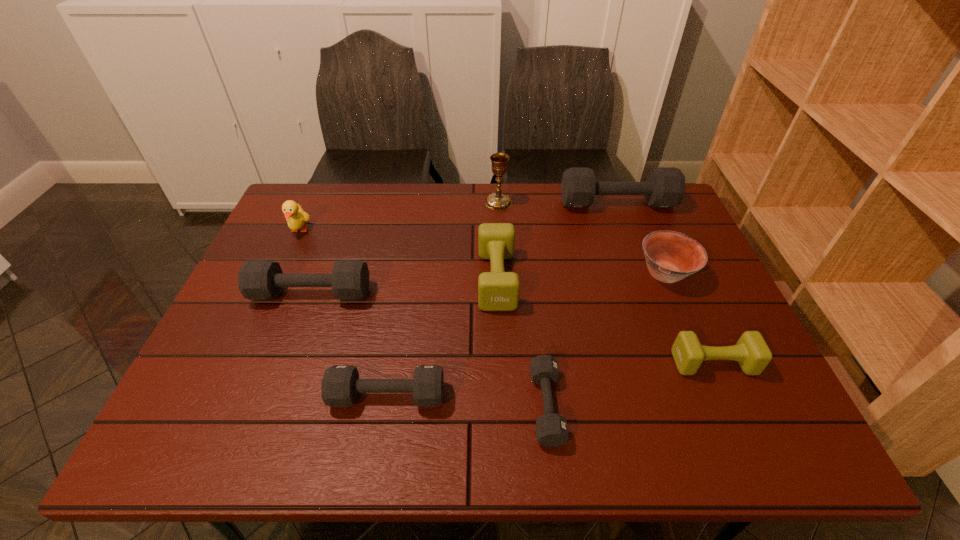
The image size is (960, 540). I want to click on vacant area that satisfies the following two spatial constraints: 1. on the back side of the third biggest gray dumbbell; 2. on the left side of the smaller olive dumbbell, so click(x=393, y=363).

Where is `free region that satisfies the following two spatial constraints: 1. on the front side of the chalice; 2. on the left side of the shortest dumbbell`? The image size is (960, 540). free region that satisfies the following two spatial constraints: 1. on the front side of the chalice; 2. on the left side of the shortest dumbbell is located at coordinates (509, 406).

At what (x,y) coordinates should I click in order to perform the action: click on free location that satisfies the following two spatial constraints: 1. on the back side of the tallest object; 2. on the left side of the third biggest gray dumbbell. Please return your answer as a coordinate pair (x, y). Looking at the image, I should click on (420, 202).

Identify the location of free space that satisfies the following two spatial constraints: 1. on the front-facing side of the third farthest object; 2. on the right side of the farther olive dumbbell. (277, 279).